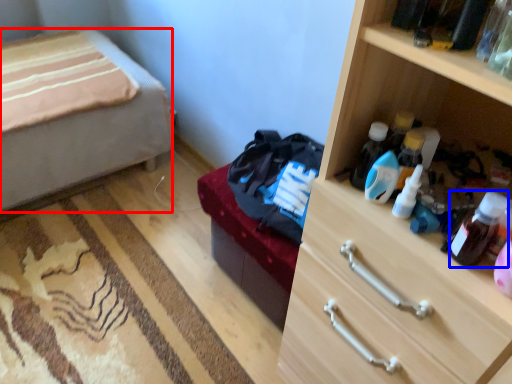
Question: Among these objects, which one is nearest to the camera, desk (highlighted by a red box) or bottle (highlighted by a blue box)?

Choices:
 (A) desk
 (B) bottle

Answer: (B)